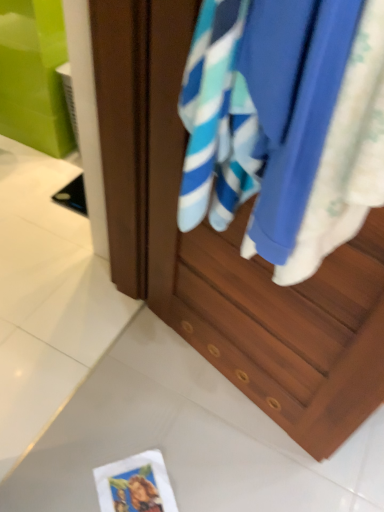
Question: From the image's perspective, is blue cotton towel at center positioned above or below white paper postcard at lower center?

Choices:
 (A) below
 (B) above

Answer: (B)

Question: In the image, is blue cotton towel at center on the left side or the right side of white paper postcard at lower center?

Choices:
 (A) left
 (B) right

Answer: (B)

Question: Considering the real-world distances, which object is farthest from the wooden cabinet at center?

Choices:
 (A) white glossy tile at lower center
 (B) blue cotton towel at center
 (C) white paper postcard at lower center

Answer: (C)

Question: Which object is the farthest from the blue cotton towel at center?

Choices:
 (A) white glossy tile at lower center
 (B) wooden cabinet at center
 (C) white paper postcard at lower center

Answer: (C)